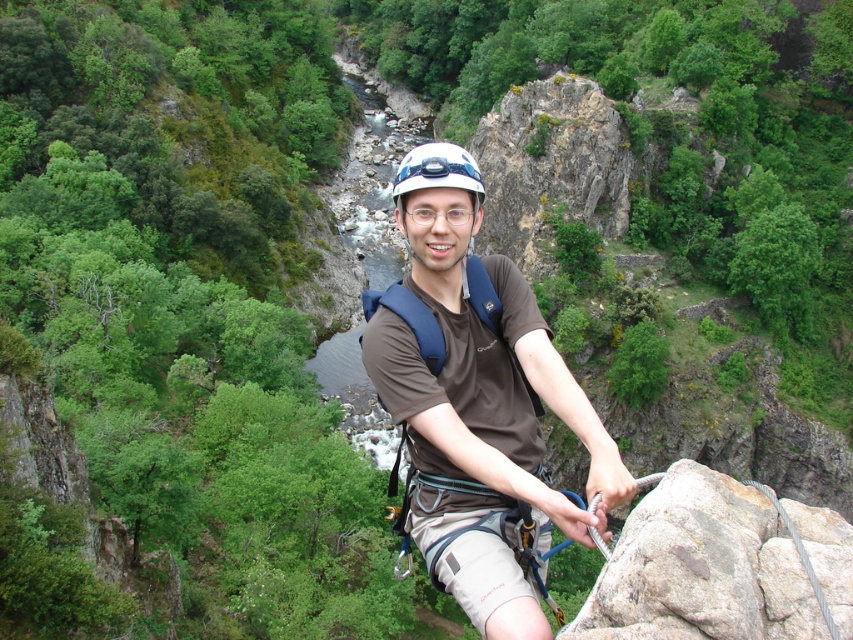
Question: Which object is closer to the camera taking this photo?

Choices:
 (A) brown fabric shirt at center
 (B) white matte helmet at center

Answer: (A)

Question: Does brown fabric shirt at center have a greater width compared to white matte helmet at center?

Choices:
 (A) no
 (B) yes

Answer: (A)

Question: Is brown fabric shirt at center in front of white matte helmet at center?

Choices:
 (A) yes
 (B) no

Answer: (A)

Question: Is brown fabric shirt at center to the right of white matte helmet at center from the viewer's perspective?

Choices:
 (A) yes
 (B) no

Answer: (A)